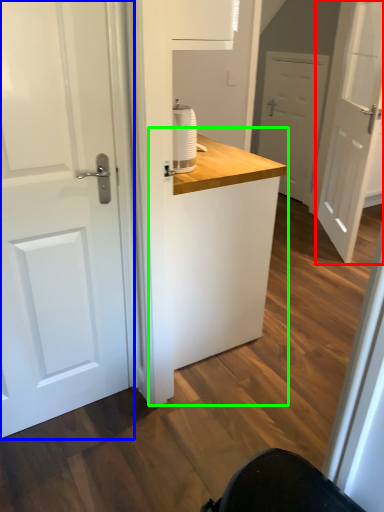
Question: Which object is the closest to the door (highlighted by a red box)? Choose among these: door (highlighted by a blue box) or counter (highlighted by a green box).

Choices:
 (A) door
 (B) counter

Answer: (B)